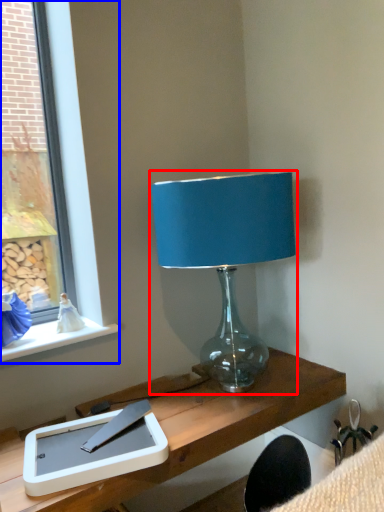
Question: Which object appears closest to the camera in this image, lamp (highlighted by a red box) or window (highlighted by a blue box)?

Choices:
 (A) lamp
 (B) window

Answer: (A)